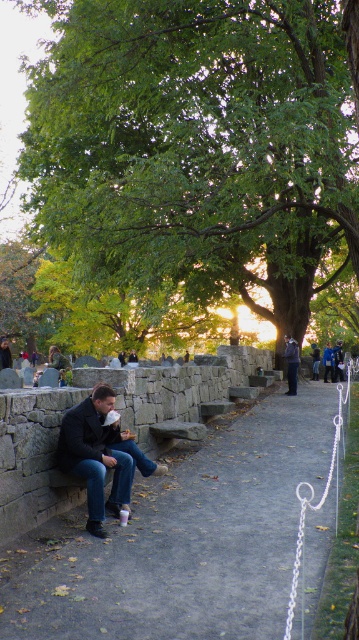
Question: Where is blue denim jeans at center located in relation to green fabric jacket at center in the image?

Choices:
 (A) left
 (B) right

Answer: (B)

Question: Which point is farther to the camera?

Choices:
 (A) [x=300, y=612]
 (B) [x=36, y=61]

Answer: (B)

Question: Is matte stone bench at center further to the viewer compared to blue denim jeans at center?

Choices:
 (A) no
 (B) yes

Answer: (A)

Question: Which object is positioned closest to the matte stone bench at center?

Choices:
 (A) green fabric jacket at center
 (B) dark blue jacket at center

Answer: (A)

Question: Can you confirm if green leafy tree at upper center is positioned to the right of blue denim jeans at center?

Choices:
 (A) no
 (B) yes

Answer: (A)

Question: Which object is the closest to the matte black jacket at left?

Choices:
 (A) matte stone bench at center
 (B) blue denim jeans at center

Answer: (A)